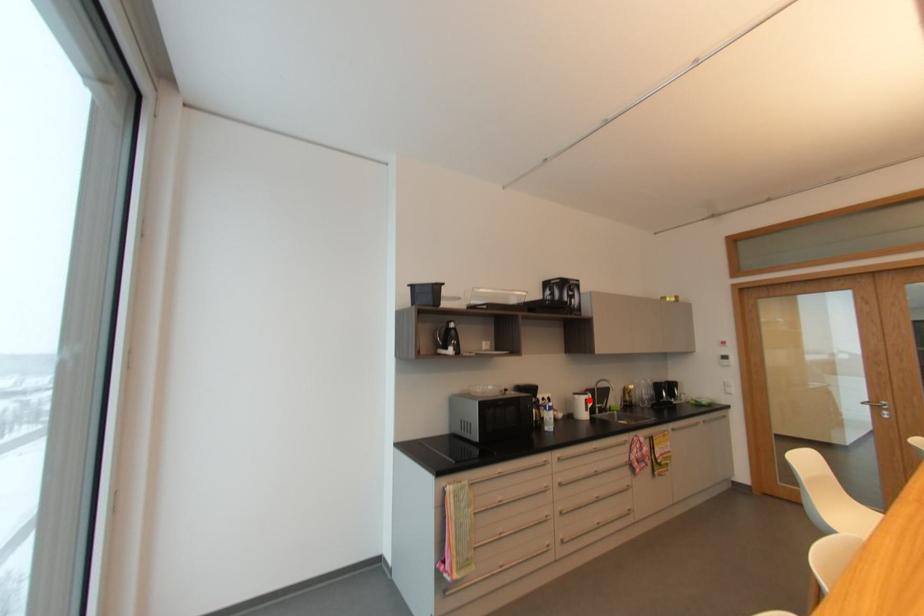
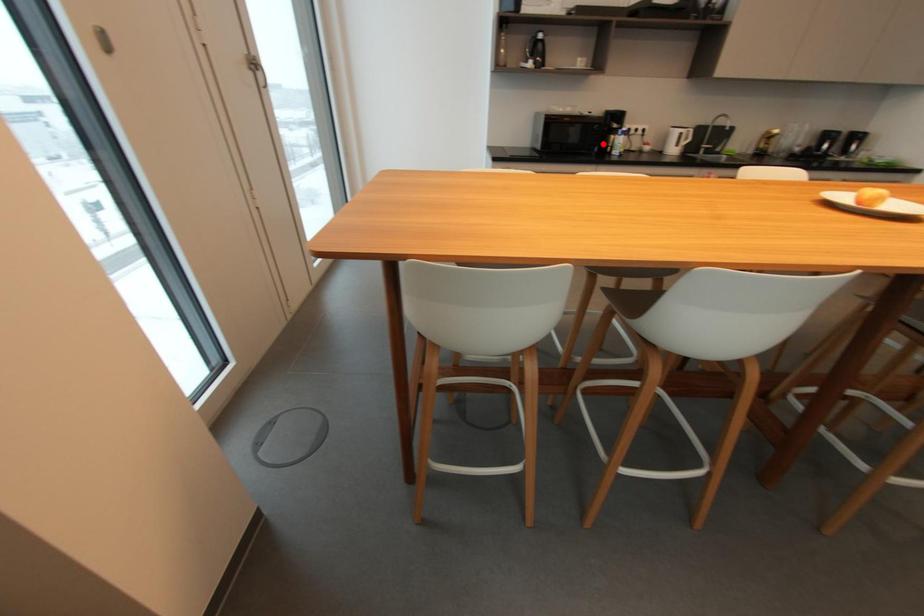
I am providing you with two images of the same scene from different viewpoints. A red point is marked on the first image and another point is marked on the second image. Do the highlighted points in image1 and image2 indicate the same real-world spot?

No